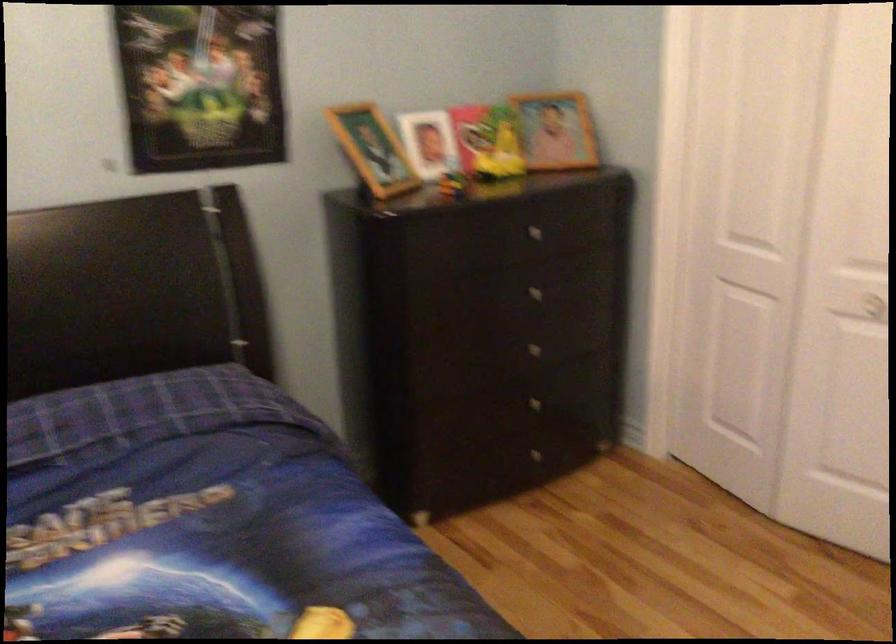
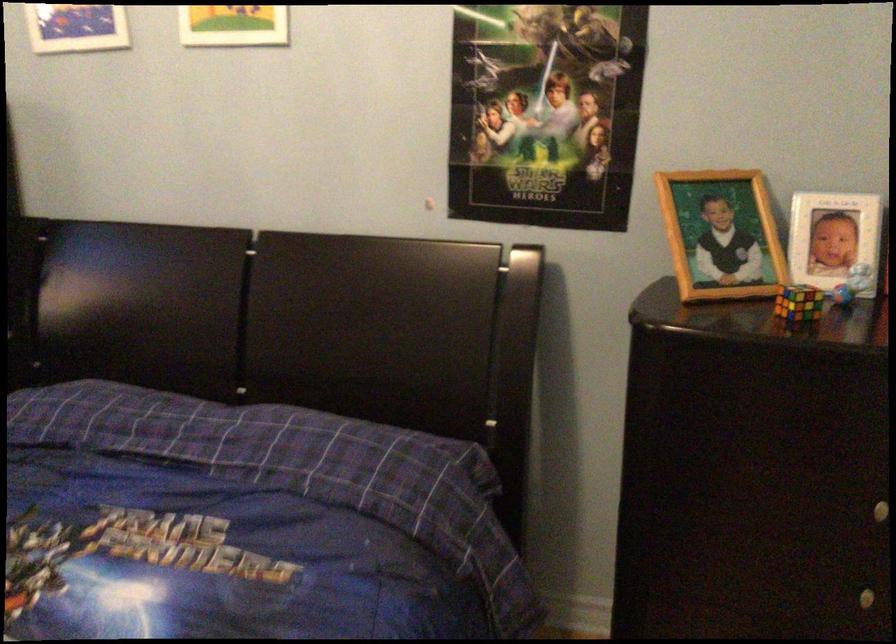
Find the pixel in the second image that matches (371,144) in the first image.

(720, 234)